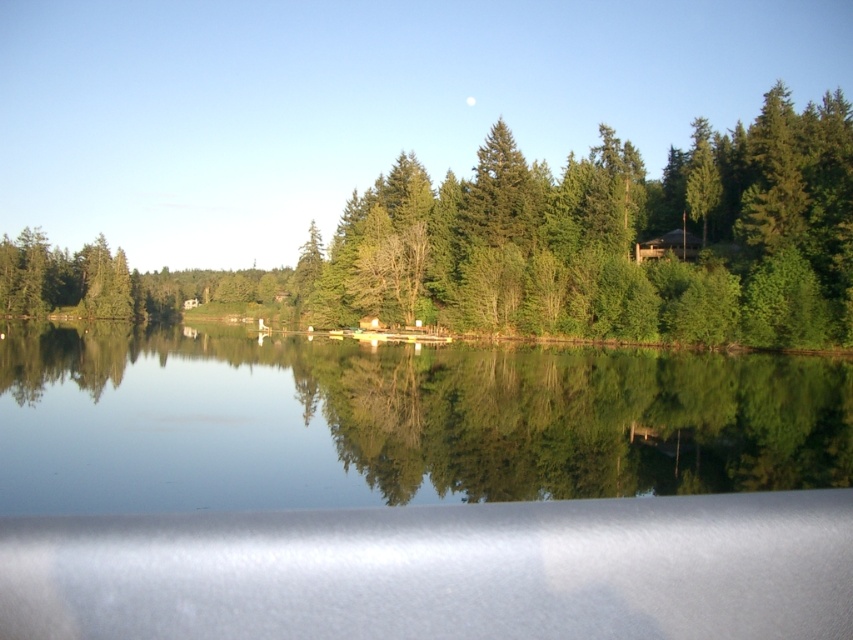
Question: Which is nearer to the green reflective water at center?

Choices:
 (A) green matte forest at center
 (B) transparent glass car window at lower center
 (C) brown wooden cabin at upper right

Answer: (B)

Question: Does green reflective water at center lie behind green matte forest at center?

Choices:
 (A) yes
 (B) no

Answer: (B)

Question: Can you confirm if green reflective water at center is positioned below green matte forest at center?

Choices:
 (A) yes
 (B) no

Answer: (A)

Question: Considering the real-world distances, which object is farthest from the green reflective water at center?

Choices:
 (A) transparent glass car window at lower center
 (B) green matte forest at center

Answer: (B)

Question: Which object is the farthest from the green matte forest at center?

Choices:
 (A) green reflective water at center
 (B) brown wooden cabin at upper right
 (C) transparent glass car window at lower center

Answer: (C)

Question: Is green reflective water at center above green matte forest at center?

Choices:
 (A) no
 (B) yes

Answer: (A)